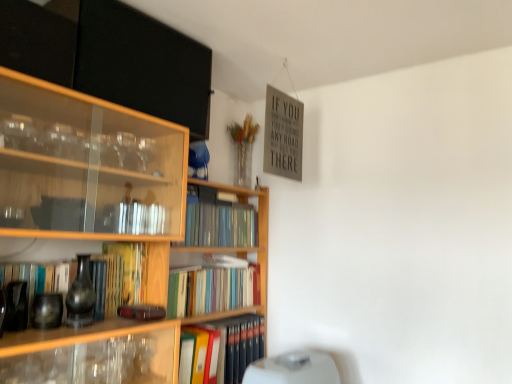
Question: Is hardcover book at center, marked as the first book in a bottom-to-top arrangement, outside of white plastic water heater at lower center?

Choices:
 (A) yes
 (B) no

Answer: (A)

Question: Does hardcover book at center, marked as the first book in a bottom-to-top arrangement, appear on the right side of white plastic water heater at lower center?

Choices:
 (A) no
 (B) yes

Answer: (A)

Question: Is hardcover book at center, which ranks as the 4th book in top-to-bottom order, aimed at white plastic water heater at lower center?

Choices:
 (A) yes
 (B) no

Answer: (A)

Question: Can you confirm if hardcover book at center, which ranks as the 4th book in top-to-bottom order, is taller than white plastic water heater at lower center?

Choices:
 (A) yes
 (B) no

Answer: (A)

Question: Considering the relative positions of hardcover book at center, which ranks as the 4th book in top-to-bottom order, and white plastic water heater at lower center in the image provided, is hardcover book at center, which ranks as the 4th book in top-to-bottom order, behind white plastic water heater at lower center?

Choices:
 (A) yes
 (B) no

Answer: (A)

Question: Does hardcover book at center, which ranks as the 4th book in top-to-bottom order, have a larger size compared to white plastic water heater at lower center?

Choices:
 (A) no
 (B) yes

Answer: (A)

Question: Can you see hardcover books at center, the 1th book when ordered from top to bottom, touching hardcover book at center, which ranks as the 4th book in top-to-bottom order?

Choices:
 (A) no
 (B) yes

Answer: (A)

Question: From the image's perspective, does hardcover books at center, the 1th book when ordered from top to bottom, appear higher than hardcover book at center, marked as the first book in a bottom-to-top arrangement?

Choices:
 (A) yes
 (B) no

Answer: (A)

Question: Is hardcover books at center, the 1th book when ordered from top to bottom, completely or partially outside of hardcover book at center, which ranks as the 4th book in top-to-bottom order?

Choices:
 (A) yes
 (B) no

Answer: (A)

Question: Is hardcover books at center, the 1th book when ordered from top to bottom, oriented towards hardcover book at center, marked as the first book in a bottom-to-top arrangement?

Choices:
 (A) no
 (B) yes

Answer: (A)

Question: Considering the relative sizes of hardcover books at center, placed as the 4th book when sorted from bottom to top, and hardcover book at center, which ranks as the 4th book in top-to-bottom order, in the image provided, is hardcover books at center, placed as the 4th book when sorted from bottom to top, thinner than hardcover book at center, which ranks as the 4th book in top-to-bottom order,?

Choices:
 (A) no
 (B) yes

Answer: (A)

Question: Would you consider hardcover books at center, placed as the 4th book when sorted from bottom to top, to be distant from hardcover book at center, which ranks as the 4th book in top-to-bottom order?

Choices:
 (A) no
 (B) yes

Answer: (A)

Question: Could hardcover books at center, the 1th book when ordered from top to bottom, be considered to be inside wooden bookcase at center?

Choices:
 (A) yes
 (B) no

Answer: (A)